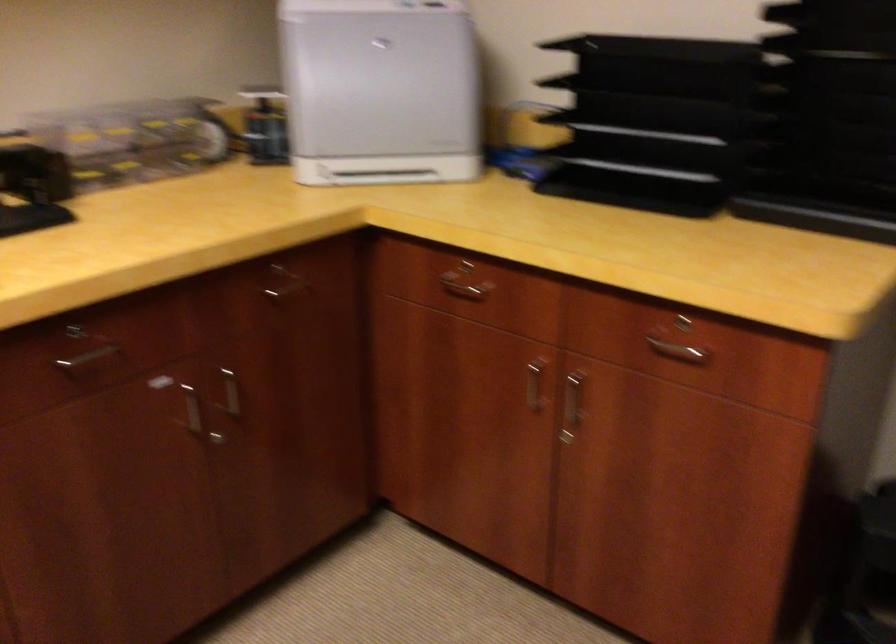
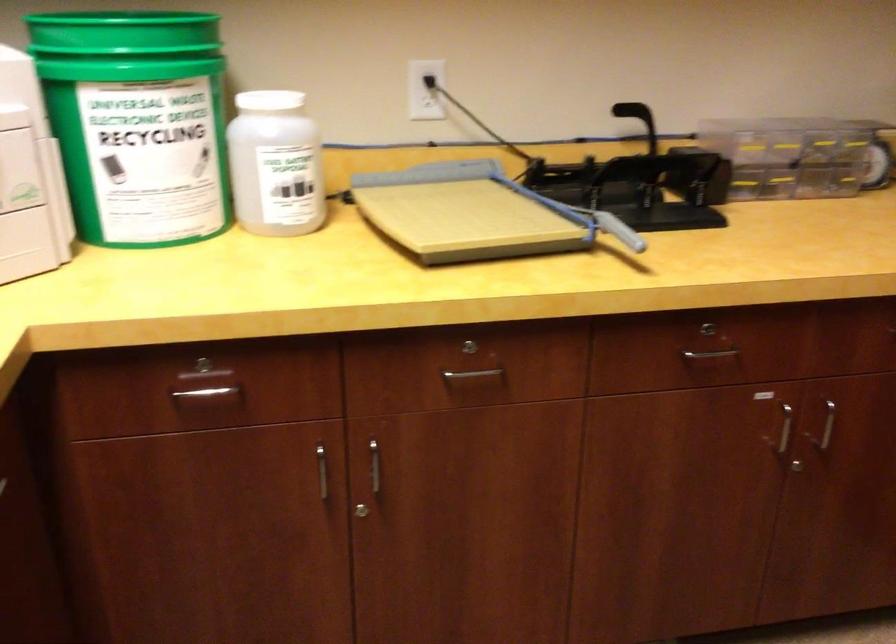
Question: The first image is from the beginning of the video and the second image is from the end. How did the camera likely rotate when shooting the video?

Choices:
 (A) Left
 (B) Right
 (C) Up
 (D) Down

Answer: (A)